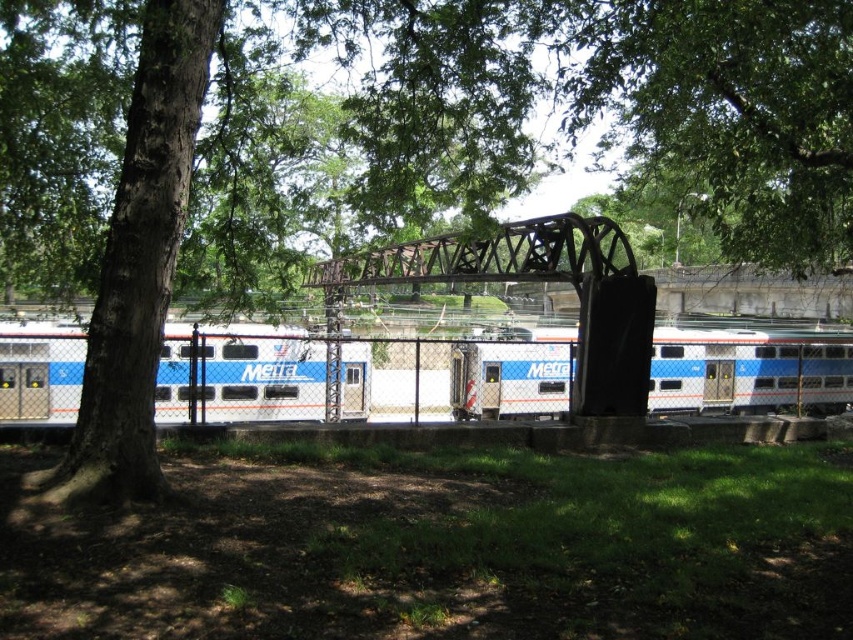
You are a photographer standing in the park and see the silver metallic train at left and the rusty metal train bridge at center. Which object would appear closer to you in the photo?

The silver metallic train at left appears closer to you because it is larger in size than the rusty metal train bridge at center, indicating proximity due to perspective.

You are a photographer trying to capture both the white glossy train at center and the silver metallic train at left in a single shot. Based on their widths, which train should you position closer to the edge of the frame to ensure both fit without cropping?

The white glossy train at center is wider than the silver metallic train at left, so you should position the wider white glossy train at center closer to the edge of the frame to ensure both fit without cropping.

You are standing at the center of the image and want to locate the silver metallic train at left. According to the coordinates, in which direction should you look to find it?

The silver metallic train at left is located at coordinates 0.584 on the x axis and 0.305 on the y axis. Since you are at the center, which is at 0.5 on both axes, the train is slightly to the right and above your current position. Therefore, you should look to the upper right direction to find the silver metallic train at left.